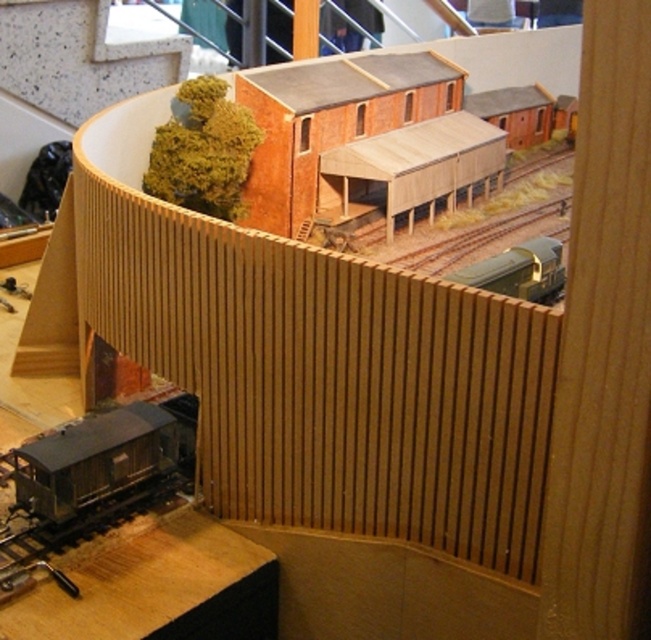
From the picture: How much distance is there between metallic gray train car at lower left and metallic gold train at center?

A distance of 1.94 meters exists between metallic gray train car at lower left and metallic gold train at center.

Does metallic gray train car at lower left appear on the right side of metallic gold train at center?

No, metallic gray train car at lower left is not to the right of metallic gold train at center.

The width and height of the screenshot is (651, 640). Find the location of `metallic gray train car at lower left`. metallic gray train car at lower left is located at coordinates (104, 456).